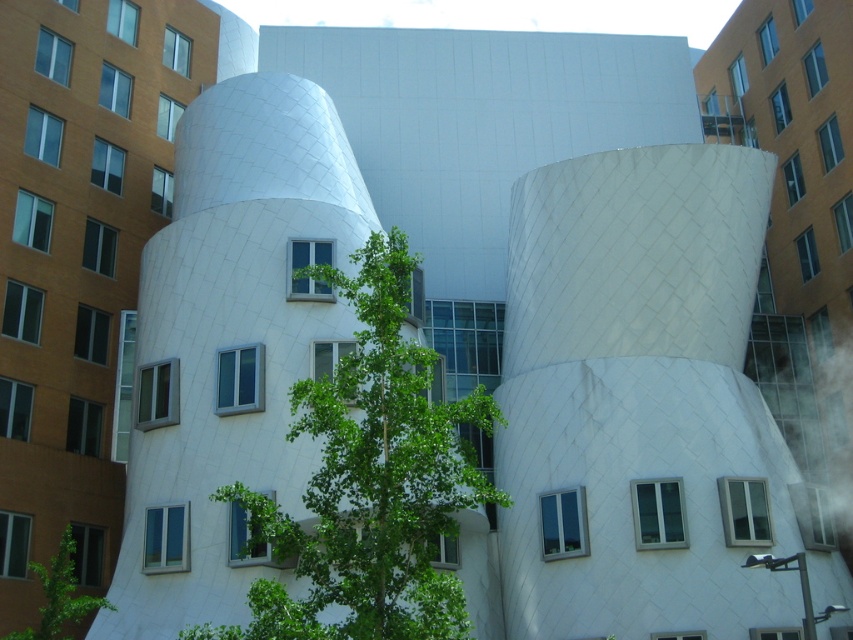
You are standing in front of the architectural structure and notice two green leafy trees. Which tree, the green leafy tree at center or the green leafy tree at lower left, is positioned higher in the image?

The green leafy tree at center is positioned higher than the green leafy tree at lower left in the image.

You are a visitor standing at the entrance of the building and want to take a photo of both the green leafy tree at center and the green leafy tree at lower left. Which tree should you position closer to the camera to include both in the frame without cropping?

You should position the green leafy tree at lower left closer to the camera because it is shorter than the green leafy tree at center, allowing both to fit in the frame without cropping.

You are a landscape architect designing a garden around the building. You need to place a new bench that requires at least 3 meters of space around it. Considering the green leafy tree at center and the green leafy tree at lower left, which tree should you avoid placing the bench near to ensure enough space?

You should avoid placing the bench near the green leafy tree at center because it has a larger size compared to the green leafy tree at lower left, meaning there is less available space around it for the bench.